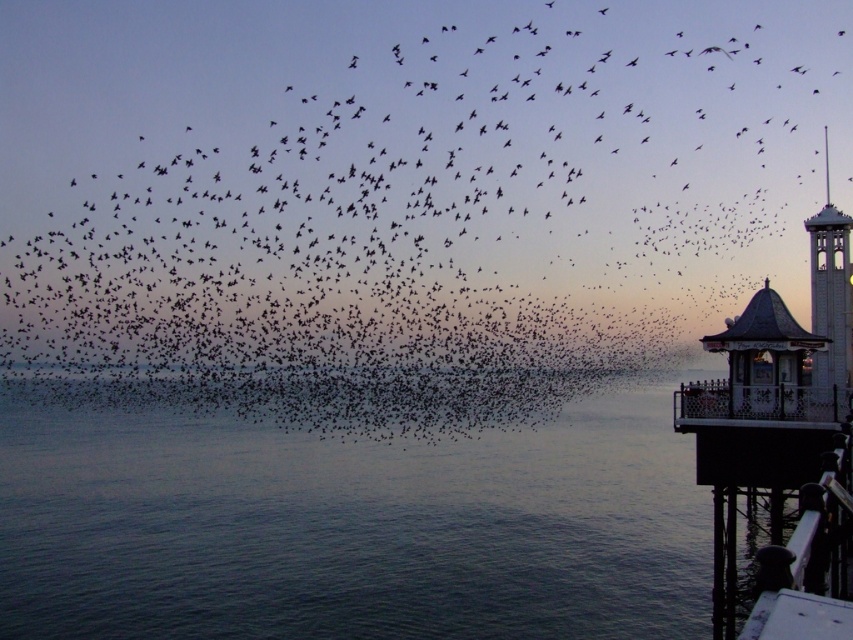
You are a photographer aiming to capture the white wood bell tower at right and the black matte birds at upper center in the same frame. Based on their positions, which object should you adjust your camera to focus on first to ensure both are in the shot?

The black matte birds at upper center is positioned on the left side of white wood bell tower at right, so you should focus on the white wood bell tower at right first to ensure both are in the frame.